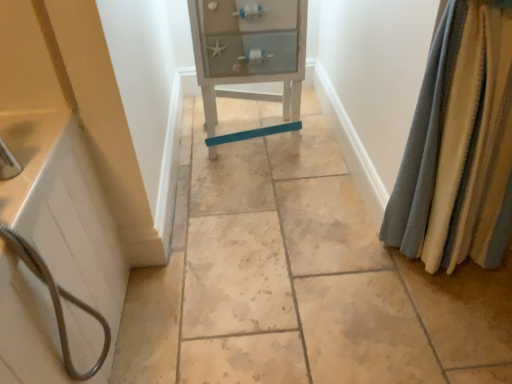
Locate an element on the screen. The width and height of the screenshot is (512, 384). free point in front of velvet-like beige curtains at right is located at coordinates (448, 327).